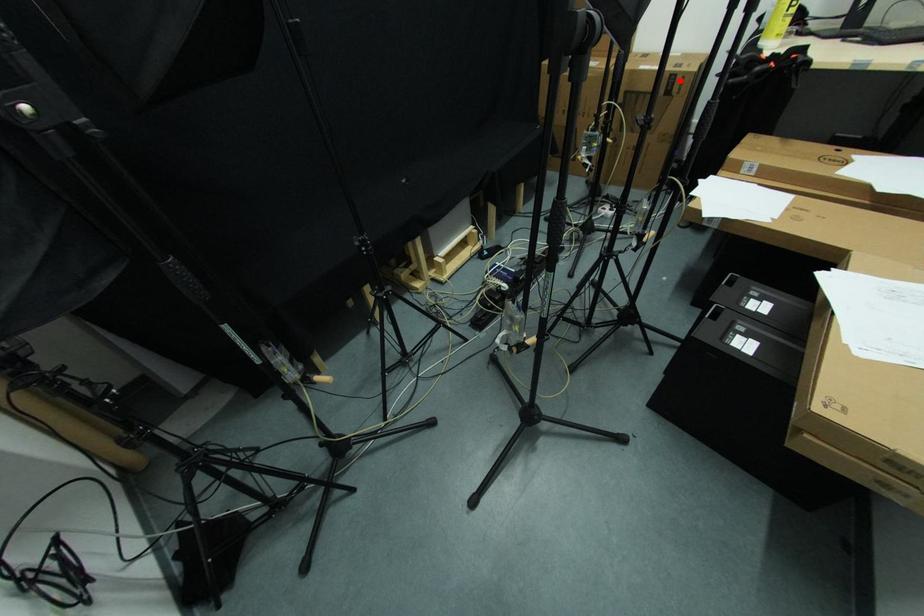
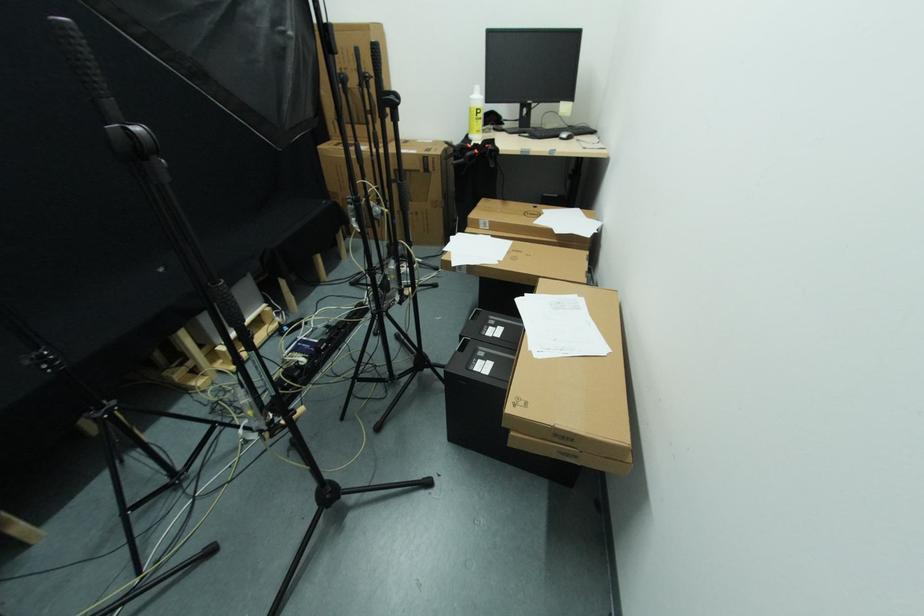
Question: I am providing you with two images of the same scene from different viewpoints. Image1 has a red point marked. In image2, the corresponding 3D location appears at what relative position? Reply with the corresponding letter.

Choices:
 (A) Closer
 (B) Farther

Answer: (A)